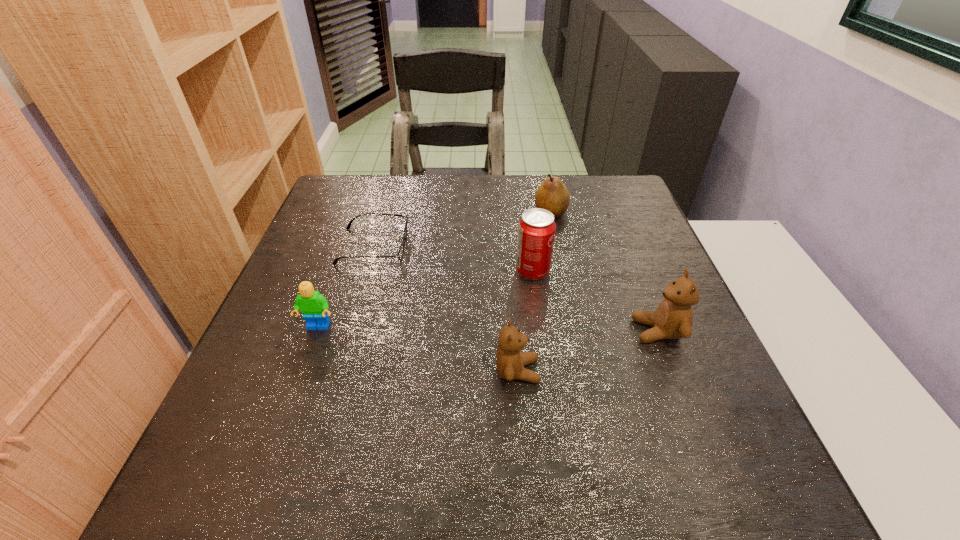
Identify the location of free area in between the Lego and the soda. (425, 300).

You are a GUI agent. You are given a task and a screenshot of the screen. Output one action in this format:
    pyautogui.click(x=<x>, y=<y>)
    Task: Click on the free point between the Lego and the farthest object
    The image size is (960, 540).
    Given the screenshot: What is the action you would take?
    pyautogui.click(x=435, y=270)

The image size is (960, 540). Identify the location of free spot between the soda and the shorter teddy bear. (525, 321).

Where is `free spot between the spectacles and the soda`? This screenshot has height=540, width=960. free spot between the spectacles and the soda is located at coordinates (453, 259).

The image size is (960, 540). What are the coordinates of `free space between the right teddy bear and the soda` in the screenshot? It's located at pyautogui.click(x=595, y=301).

Select which object is the closest to the shorter teddy bear. Please provide its 2D coordinates. Your answer should be formatted as a tuple, i.e. [(x, y)], where the tuple contains the x and y coordinates of a point satisfying the conditions above.

[(536, 230)]

Point out which object is positioned as the third nearest to the shortest object. Please provide its 2D coordinates. Your answer should be formatted as a tuple, i.e. [(x, y)], where the tuple contains the x and y coordinates of a point satisfying the conditions above.

[(510, 360)]

Where is `free point that satisfies the following two spatial constraints: 1. on the front-facing side of the soda; 2. on the right side of the spectacles`? The width and height of the screenshot is (960, 540). free point that satisfies the following two spatial constraints: 1. on the front-facing side of the soda; 2. on the right side of the spectacles is located at coordinates (366, 272).

Identify the location of free space that satisfies the following two spatial constraints: 1. on the back side of the soda; 2. on the right side of the pear. This screenshot has width=960, height=540. (525, 213).

This screenshot has height=540, width=960. Find the location of `vacant region that satisfies the following two spatial constraints: 1. on the front side of the pear; 2. on the front-facing side of the spectacles`. vacant region that satisfies the following two spatial constraints: 1. on the front side of the pear; 2. on the front-facing side of the spectacles is located at coordinates (558, 246).